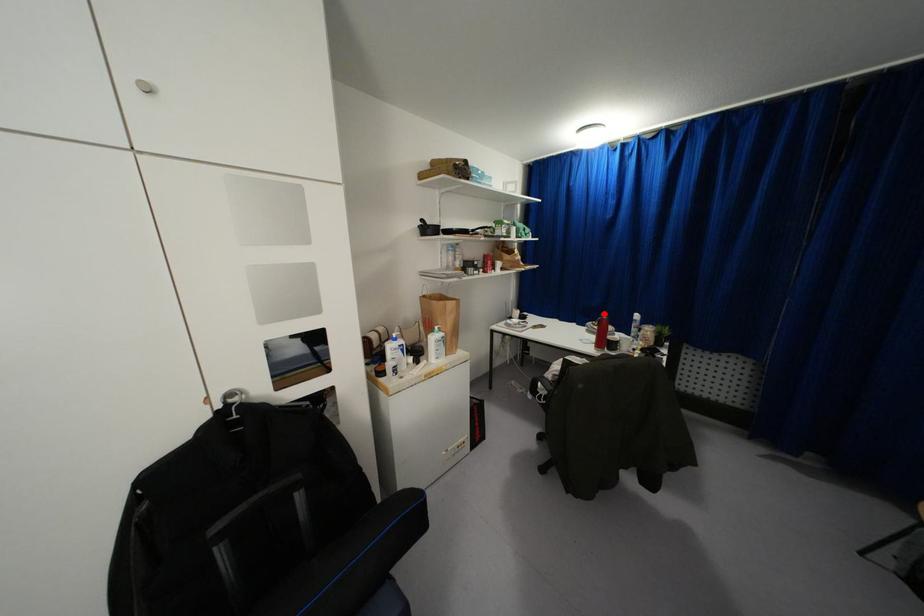
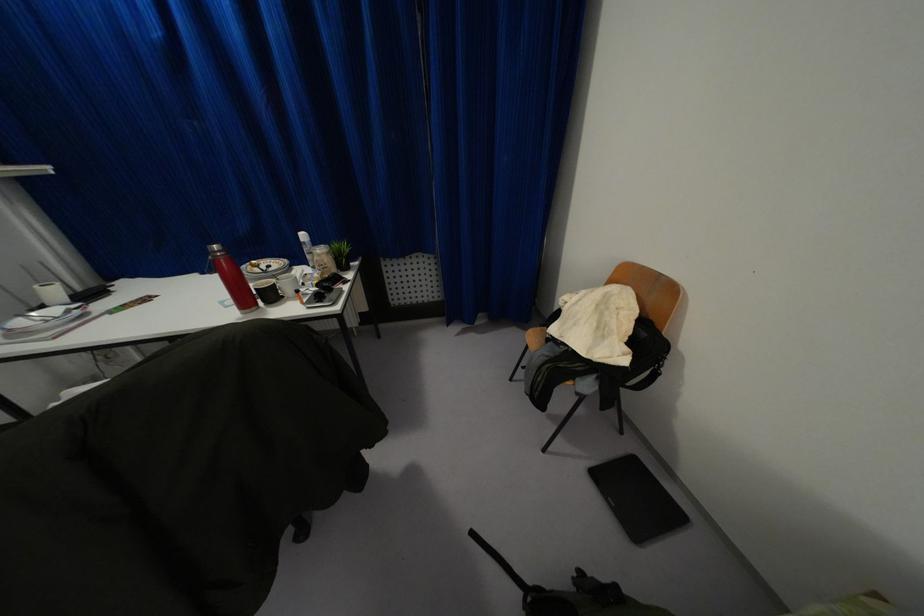
Question: I am providing you with two images of the same scene from different viewpoints. In image1, a red point is highlighted. Considering the same 3D point in image2, which of the following is correct?

Choices:
 (A) It is closer
 (B) It is farther

Answer: (B)